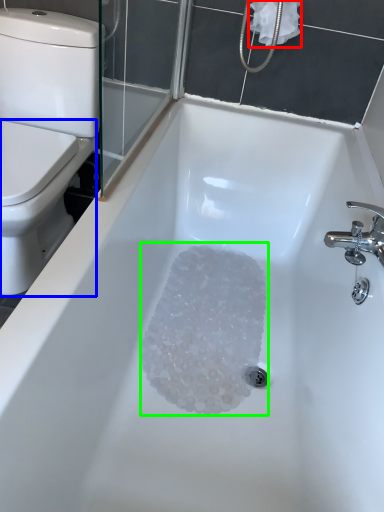
Question: Which is farther away from toilet paper (highlighted by a red box)? bidet (highlighted by a blue box) or crystal (highlighted by a green box)?

Choices:
 (A) bidet
 (B) crystal

Answer: (B)